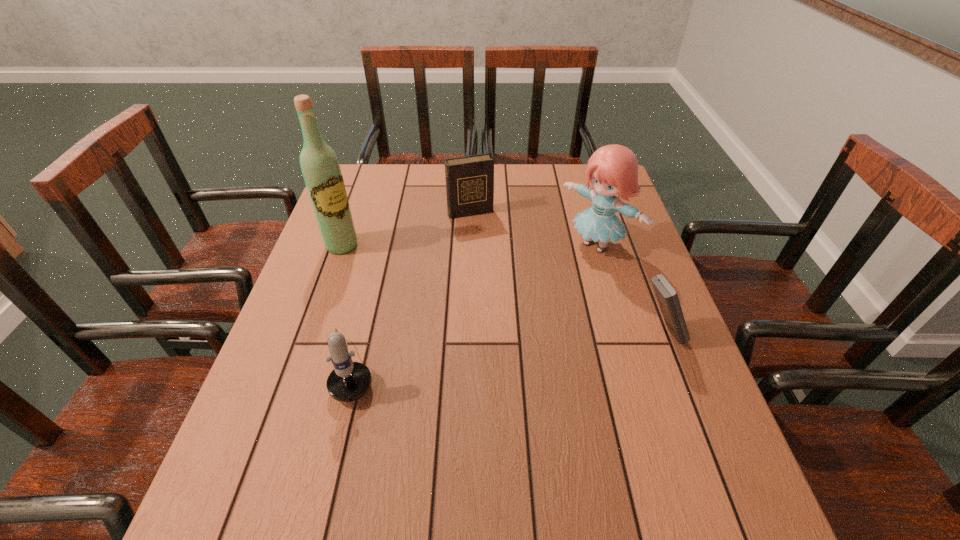
Locate an element on the screen. The height and width of the screenshot is (540, 960). the fourth object from right to left is located at coordinates (349, 381).

The width and height of the screenshot is (960, 540). Find the location of `calculator`. calculator is located at coordinates (667, 297).

Find the location of a particular element. the tallest object is located at coordinates (320, 167).

I want to click on the leftmost object, so click(x=320, y=167).

At what (x,y) coordinates should I click in order to perform the action: click on diary. Please return your answer as a coordinate pair (x, y). Looking at the image, I should click on (470, 179).

You are a GUI agent. You are given a task and a screenshot of the screen. Output one action in this format:
    pyautogui.click(x=<x>, y=<y>)
    Task: Click on the farthest object
    Image resolution: width=960 pixels, height=540 pixels.
    Given the screenshot: What is the action you would take?
    tap(470, 179)

Identify the location of doll. Image resolution: width=960 pixels, height=540 pixels. (612, 169).

Locate an element on the screen. free space located 0.280m on the back of the second object from left to right is located at coordinates (380, 251).

This screenshot has width=960, height=540. Identify the location of vacant area located 0.360m on the front-facing side of the leftmost object. (438, 323).

The width and height of the screenshot is (960, 540). In order to click on free region located 0.270m on the front-facing side of the leftmost object in this screenshot , I will do `click(414, 303)`.